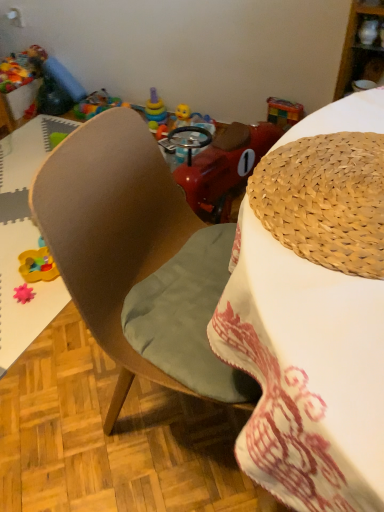
Question: Considering the relative positions of rubberized plastic toy at upper left, positioned as the 2th toy in right-to-left order, and translucent plastic sippy cup at center, acting as the 1th toy starting from the right, in the image provided, is rubberized plastic toy at upper left, positioned as the 2th toy in right-to-left order, behind translucent plastic sippy cup at center, acting as the 1th toy starting from the right,?

Choices:
 (A) yes
 (B) no

Answer: (A)

Question: Is rubberized plastic toy at upper left, which ranks as the second toy in left-to-right order, positioned with its back to translucent plastic sippy cup at center, acting as the 2th toy starting from the back?

Choices:
 (A) no
 (B) yes

Answer: (A)

Question: From the image's perspective, is rubberized plastic toy at upper left, the first toy positioned from the top, over translucent plastic sippy cup at center, the 3th toy in the left-to-right sequence?

Choices:
 (A) yes
 (B) no

Answer: (A)

Question: Would you say translucent plastic sippy cup at center, the second toy in the top-to-bottom sequence, is part of rubberized plastic toy at upper left, which ranks as the second toy in left-to-right order,'s contents?

Choices:
 (A) no
 (B) yes

Answer: (A)

Question: From the image's perspective, is rubberized plastic toy at upper left, the first toy in the back-to-front sequence, under translucent plastic sippy cup at center, acting as the 2th toy starting from the back?

Choices:
 (A) yes
 (B) no

Answer: (B)

Question: Would you say brown wooden chair at center is to the left or to the right of pink rubber star at lower left, which appears as the third toy when viewed from the back, in the picture?

Choices:
 (A) left
 (B) right

Answer: (A)

Question: Relative to pink rubber star at lower left, which appears as the third toy when viewed from the back, is brown wooden chair at center in front or behind?

Choices:
 (A) behind
 (B) front

Answer: (B)

Question: Is brown wooden chair at center inside or outside of pink rubber star at lower left, which appears as the third toy when viewed from the back?

Choices:
 (A) inside
 (B) outside

Answer: (B)

Question: Is brown wooden chair at center bigger or smaller than pink rubber star at lower left, which appears as the first toy when ordered from the bottom?

Choices:
 (A) big
 (B) small

Answer: (A)

Question: From a real-world perspective, relative to woven straw hat at upper right, is translucent plastic sippy cup at center, acting as the 2th toy starting from the back, vertically above or below?

Choices:
 (A) above
 (B) below

Answer: (B)

Question: Is point (206, 124) closer or farther from the camera than point (317, 234)?

Choices:
 (A) farther
 (B) closer

Answer: (A)

Question: From the image's perspective, relative to woven straw hat at upper right, is translucent plastic sippy cup at center, positioned as the second toy in front-to-back order, above or below?

Choices:
 (A) above
 (B) below

Answer: (A)

Question: Is translucent plastic sippy cup at center, acting as the 2th toy starting from the back, wider or thinner than woven straw hat at upper right?

Choices:
 (A) wide
 (B) thin

Answer: (B)

Question: Considering the relative positions of translucent plastic sippy cup at center, acting as the 1th toy starting from the right, and pink rubber star at lower left, which appears as the third toy when viewed from the back, in the image provided, is translucent plastic sippy cup at center, acting as the 1th toy starting from the right, to the left or to the right of pink rubber star at lower left, which appears as the third toy when viewed from the back,?

Choices:
 (A) right
 (B) left

Answer: (A)

Question: Choose the correct answer: Is translucent plastic sippy cup at center, acting as the 1th toy starting from the right, inside pink rubber star at lower left, which ranks as the 1th toy in front-to-back order, or outside it?

Choices:
 (A) outside
 (B) inside

Answer: (A)